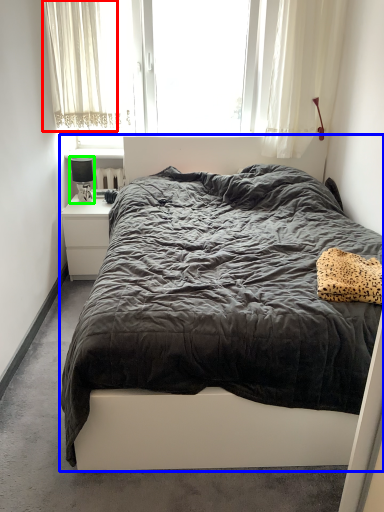
Question: Considering the real-world distances, which object is closest to curtain (highlighted by a red box)? bed (highlighted by a blue box) or lamp (highlighted by a green box).

Choices:
 (A) bed
 (B) lamp

Answer: (B)